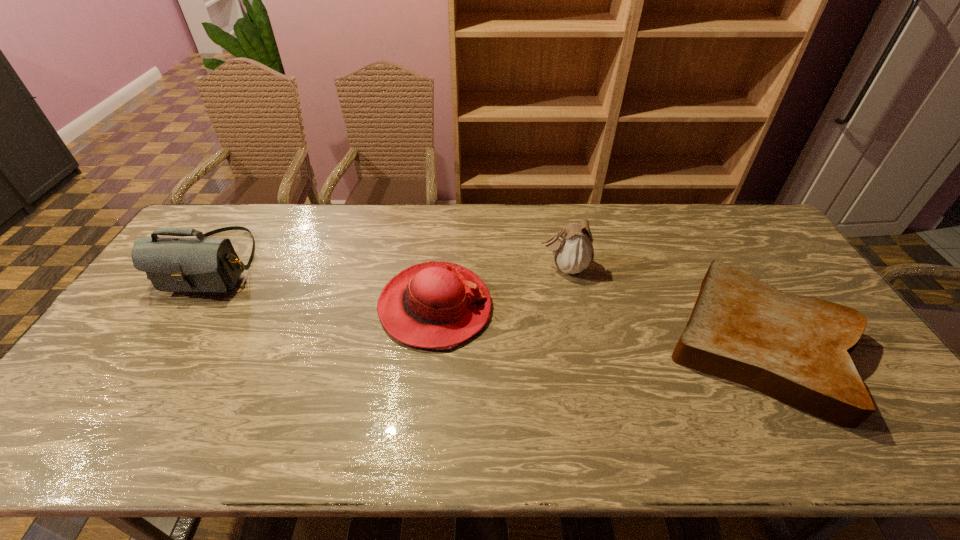
Find the location of `blank space that satisfies the following two spatial constraints: 1. on the front-facing side of the pouch; 2. on the back side of the bread`. blank space that satisfies the following two spatial constraints: 1. on the front-facing side of the pouch; 2. on the back side of the bread is located at coordinates (580, 343).

Where is `free space in the image that satisfies the following two spatial constraints: 1. on the front-facing side of the shortest object; 2. on the right side of the second object from right to left`? The height and width of the screenshot is (540, 960). free space in the image that satisfies the following two spatial constraints: 1. on the front-facing side of the shortest object; 2. on the right side of the second object from right to left is located at coordinates (580, 343).